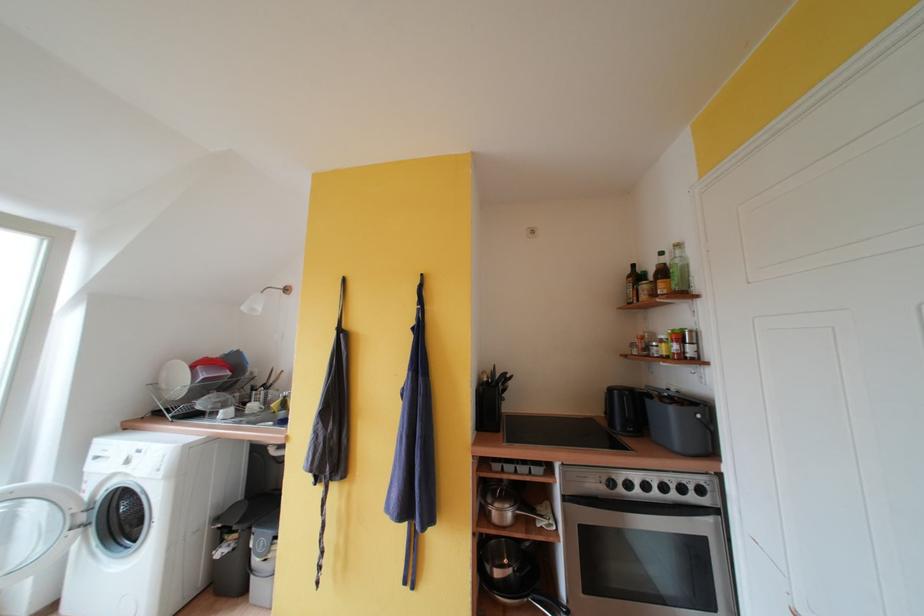
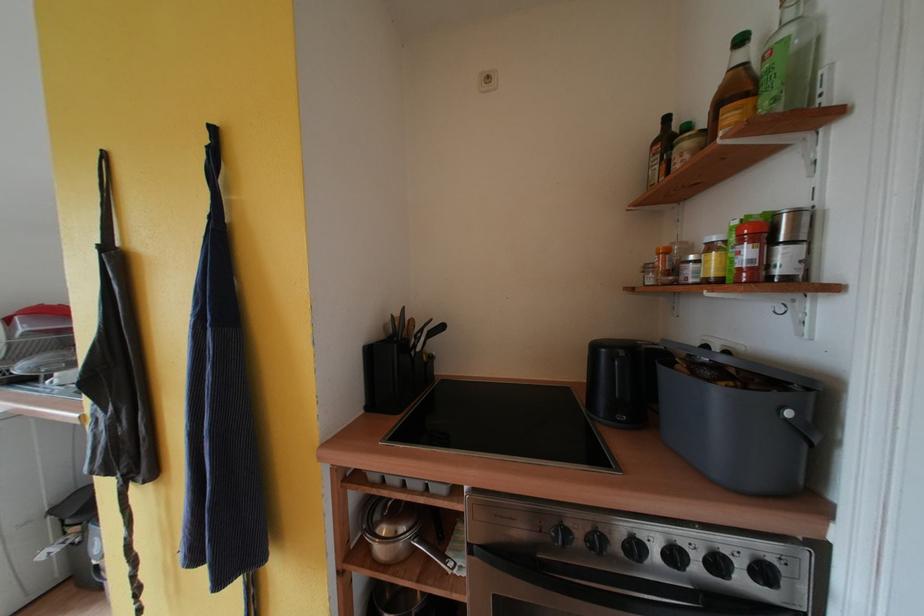
Which direction would the cameraman need to move to produce the second image?

The movement direction of the cameraman is right, forward.